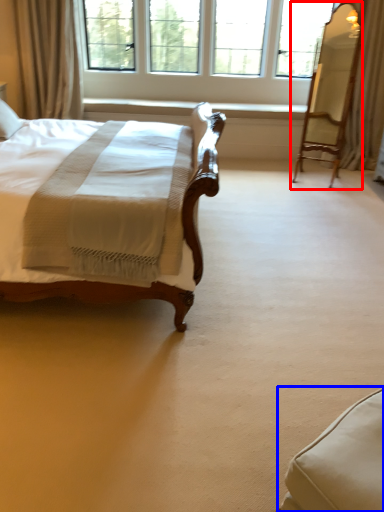
Question: Which object appears farthest to the camera in this image, swivel chair (highlighted by a red box) or swivel chair (highlighted by a blue box)?

Choices:
 (A) swivel chair
 (B) swivel chair

Answer: (A)